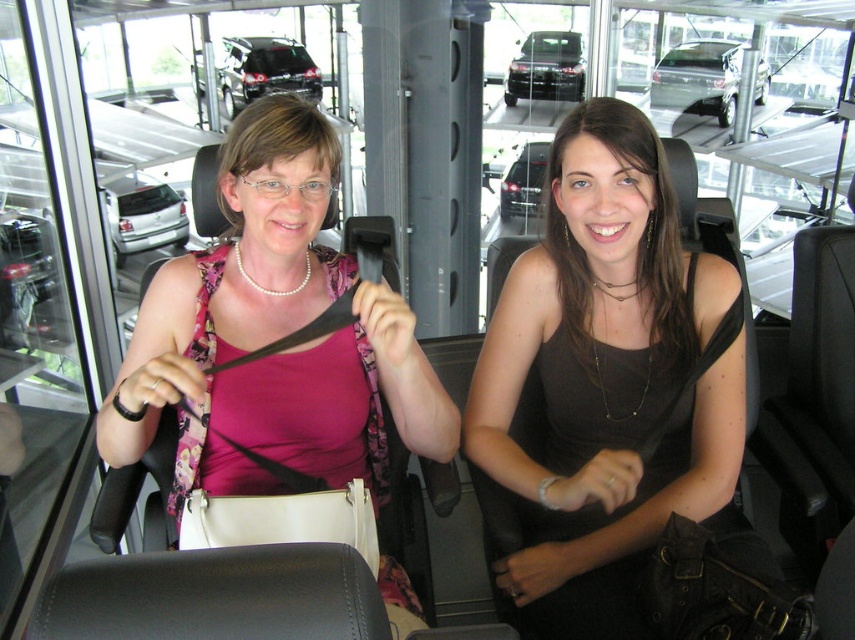
Which is more to the right, matte black tank top at center or matte pink shirt at center?

Positioned to the right is matte black tank top at center.

Does matte black tank top at center lie behind matte pink shirt at center?

Yes, it is behind matte pink shirt at center.

Image resolution: width=855 pixels, height=640 pixels. What are the coordinates of `matte black tank top at center` in the screenshot? It's located at (606, 380).